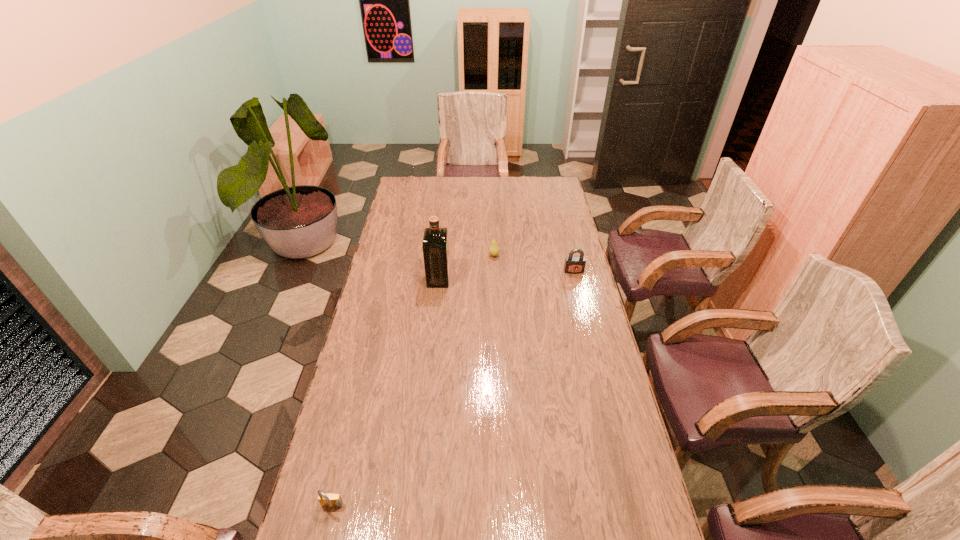
Where is `the tallest object`? Image resolution: width=960 pixels, height=540 pixels. the tallest object is located at coordinates (435, 245).

Identify the location of liquor. Image resolution: width=960 pixels, height=540 pixels. (435, 245).

Where is `the taller padlock`? The width and height of the screenshot is (960, 540). the taller padlock is located at coordinates (573, 264).

Where is `the rightmost object`? the rightmost object is located at coordinates (573, 264).

Where is `the farthest object`? the farthest object is located at coordinates (494, 250).

This screenshot has height=540, width=960. What are the coordinates of `pear` in the screenshot? It's located at (494, 250).

In order to click on the left padlock in this screenshot , I will do `click(329, 500)`.

At what (x,y) coordinates should I click in order to perform the action: click on the nearer padlock. Please return your answer as a coordinate pair (x, y). Looking at the image, I should click on (329, 500).

The height and width of the screenshot is (540, 960). What are the coordinates of `vacant position located on the front label of the second object from left to right` in the screenshot? It's located at (461, 279).

Locate an element on the screen. This screenshot has width=960, height=540. free space located on the front of the farther padlock near the keyhole is located at coordinates (584, 310).